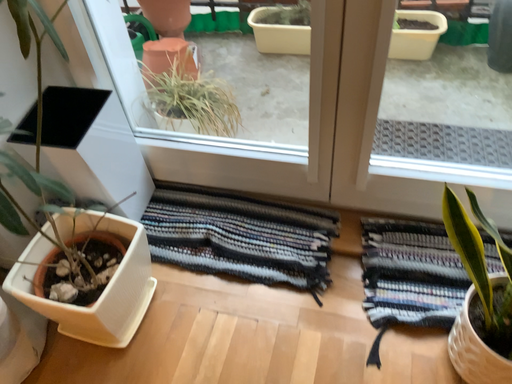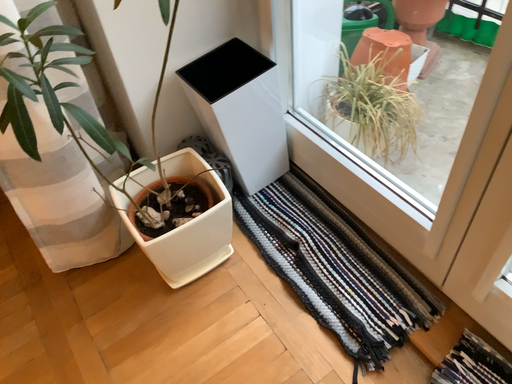
Question: How did the camera likely rotate when shooting the video?

Choices:
 (A) rotated left
 (B) rotated right

Answer: (A)